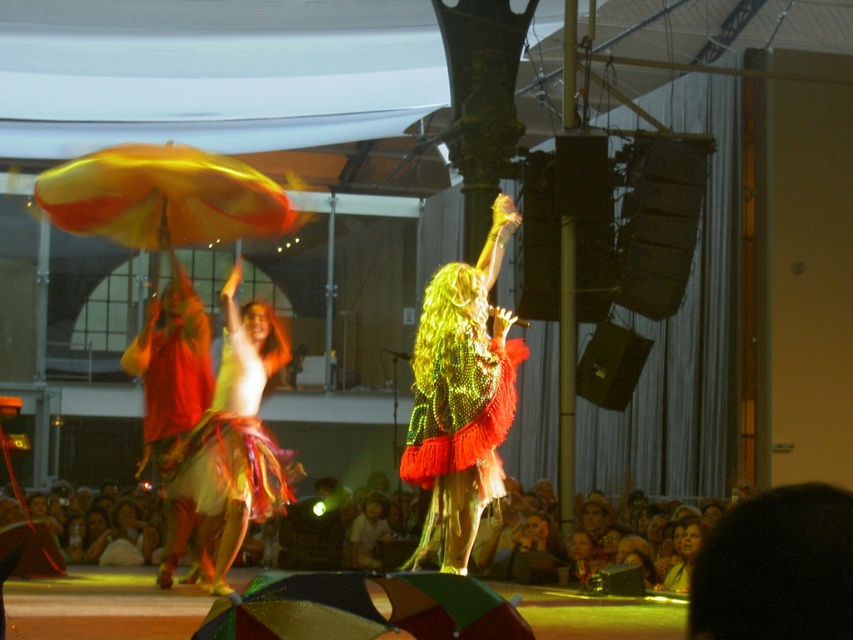
Question: Estimate the real-world distances between objects in this image. Which object is closer to the green sequined dress at center?

Choices:
 (A) matte skin audience at lower center
 (B) shiny metallic skirt at center

Answer: (B)

Question: Can you confirm if matte skin audience at lower center is positioned to the right of shiny metallic skirt at center?

Choices:
 (A) no
 (B) yes

Answer: (A)

Question: Which of the following is the closest to the observer?

Choices:
 (A) 386,570
 (B) 412,476

Answer: (B)

Question: Which point appears farthest from the camera in this image?

Choices:
 (A) (561, 570)
 (B) (437, 456)

Answer: (A)

Question: Is matte skin audience at lower center smaller than green sequined dress at center?

Choices:
 (A) no
 (B) yes

Answer: (B)

Question: Is matte skin audience at lower center positioned at the back of green sequined dress at center?

Choices:
 (A) yes
 (B) no

Answer: (A)